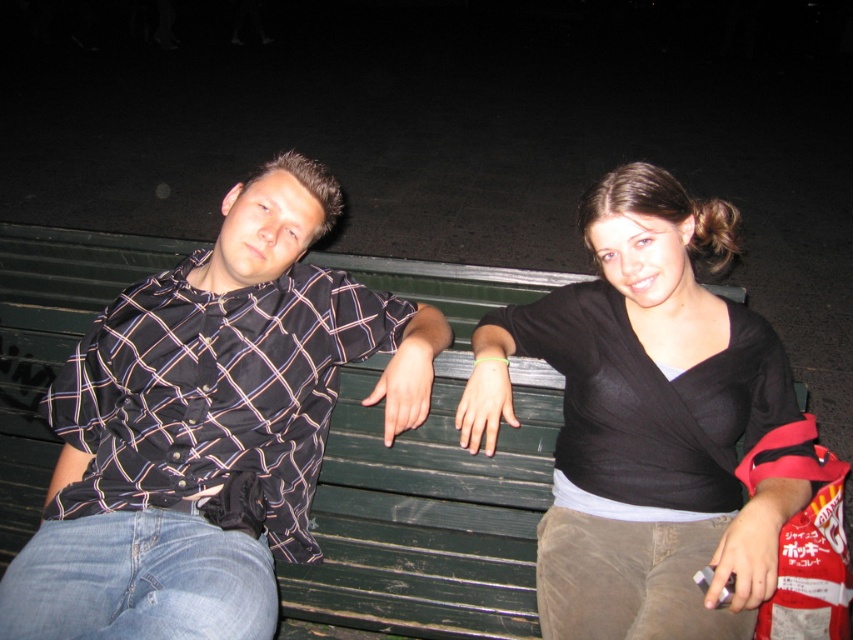
You are a photographer setting up a camera to take a photo of two people sitting on a bench. The subjects are wearing a matte black shirt at left and a black matte shirt at center. Based on their positions, which person should you adjust the lighting to highlight more?

The matte black shirt at left might be wider than black matte shirt at center, so you should adjust the lighting to highlight the matte black shirt at left more to ensure it stands out appropriately.

You are a photographer setting up a shot of the two people sitting on the bench. You want to ensure both subjects are in focus. Since the matte black shirt at left and the black matte shirt at center are at different distances, will you need to adjust the camera focus to capture both clearly?

The matte black shirt at left is closer to the viewer than the black matte shirt at center. To capture both clearly, you should adjust the camera focus to account for the distance between them, ensuring the depth of field includes both subjects.

You are standing at the origin of a coordinate system placed at the bottom left corner of the image. You want to locate the matte black shirt at left. Which direction should you move from the point marked at point (209, 426) to find it?

The point (209, 426) marks the matte black shirt at left, so you are already at the correct location.